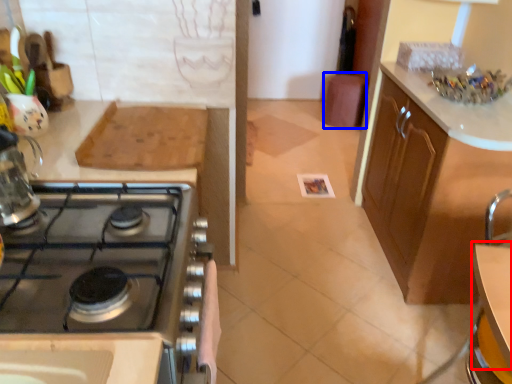
Question: Which point is further to the camera, table (highlighted by a red box) or bar stool (highlighted by a blue box)?

Choices:
 (A) table
 (B) bar stool

Answer: (B)